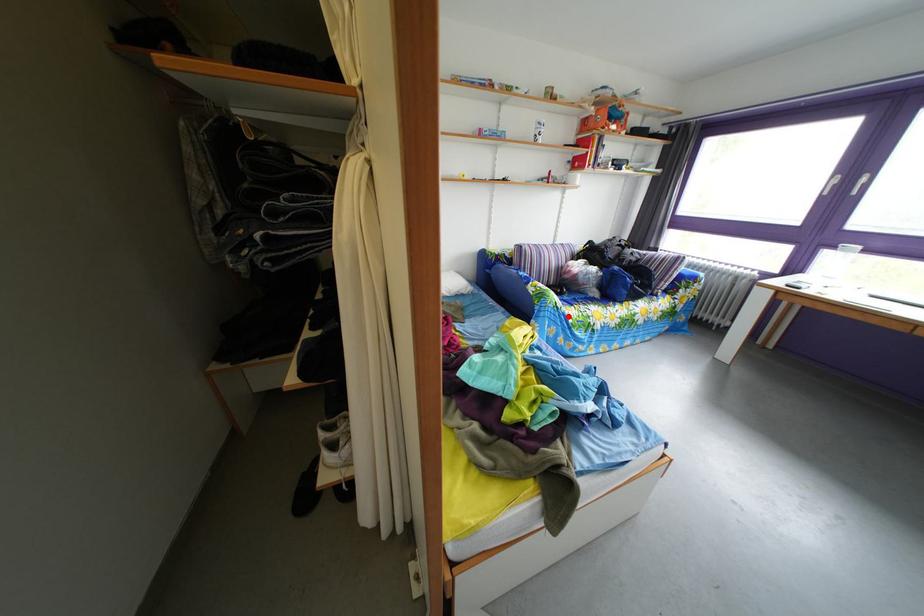
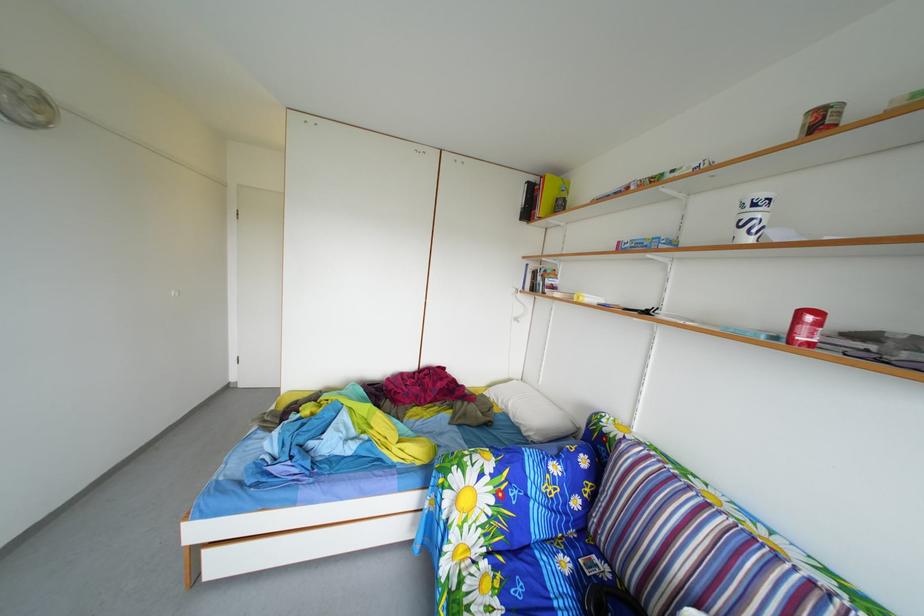
Question: A red point is marked in image1. In image2, is the corresponding 3D point closer to the camera or farther? Reply with the corresponding letter.

Choices:
 (A) The corresponding 3D point is closer.
 (B) The corresponding 3D point is farther.

Answer: (B)